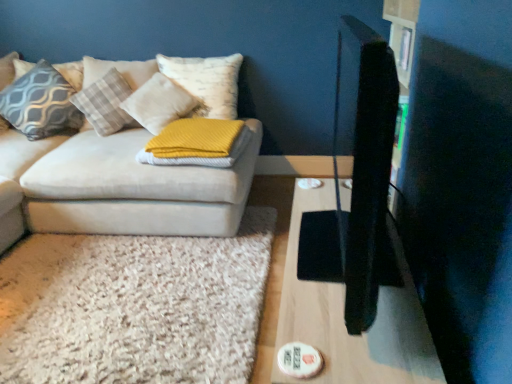
Question: In the image, is yellow knitted blanket at center, which ranks as the 5th pillow in left-to-right order, positioned in front of or behind patterned fabric pillow at upper left, which appears as the 1th pillow when viewed from the left?

Choices:
 (A) behind
 (B) front

Answer: (B)

Question: Considering the positions of yellow knitted blanket at center, which is counted as the 1th pillow, starting from the right, and patterned fabric pillow at upper left, which appears as the 1th pillow when viewed from the left, in the image, is yellow knitted blanket at center, which is counted as the 1th pillow, starting from the right, wider or thinner than patterned fabric pillow at upper left, which appears as the 1th pillow when viewed from the left,?

Choices:
 (A) thin
 (B) wide

Answer: (B)

Question: Which of these objects is positioned farthest from the plush white pillow at upper left, the third pillow when ordered from left to right?

Choices:
 (A) matte gray pillow at left, which is counted as the fourth pillow, starting from the right
 (B) patterned fabric pillow at upper left, placed as the 5th pillow when sorted from right to left
 (C) yellow knitted blanket at center, which is counted as the 1th pillow, starting from the right
 (D) velvet beige couch at left
 (E) yellow textured pillow at center, the 2th pillow in the right-to-left sequence

Answer: (C)

Question: Based on their relative distances, which object is nearer to the yellow knitted blanket at center, which is counted as the 1th pillow, starting from the right?

Choices:
 (A) plush white pillow at upper left, the third pillow when ordered from left to right
 (B) white shaggy rug at lower left
 (C) wooden table at right
 (D) yellow textured pillow at center, the fourth pillow in the left-to-right sequence
 (E) velvet beige couch at left

Answer: (E)